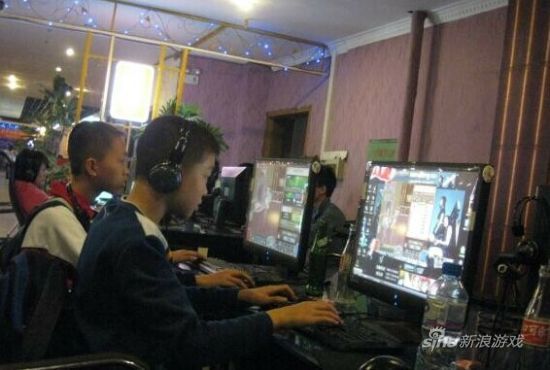
This screenshot has height=370, width=550. Identify the location of keyboards. (351, 337), (204, 263).